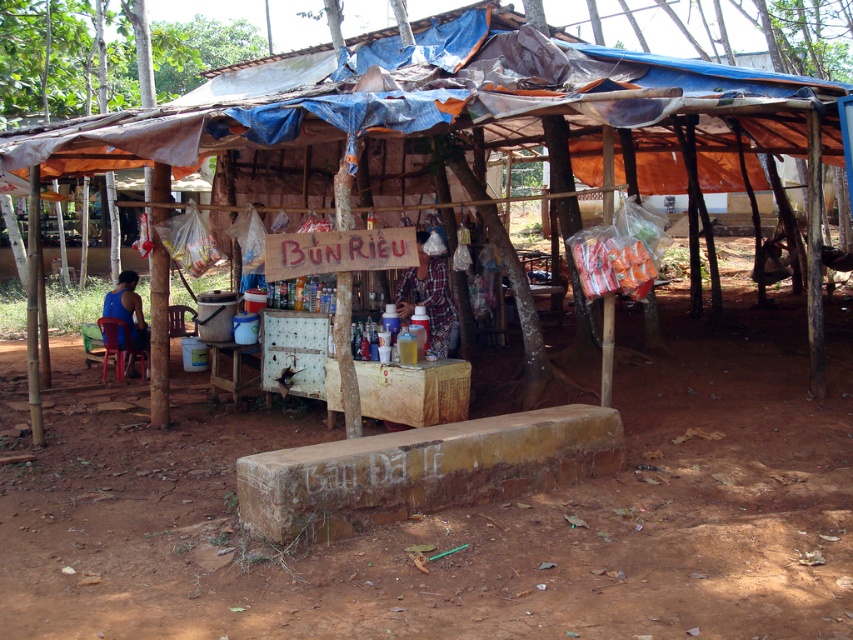
You are standing at the entrance of the rustic outdoor food stall and want to locate both the brown dirt field at center and the wooden shack at center. Based on their positions, which object is closer to your right side?

The brown dirt field at center is to the right of the wooden shack at center, so when standing at the entrance, the brown dirt field at center would be closer to your right side.

You are standing in front of the rustic outdoor food stall and want to take a photo of both the wooden shack at center and the blue fabric shirt at left. Which object should you focus on first to ensure both are in clear view?

You should focus on the wooden shack at center first since it is closer to the viewer than the blue fabric shirt at left, ensuring both are in clear view by adjusting the focus accordingly.